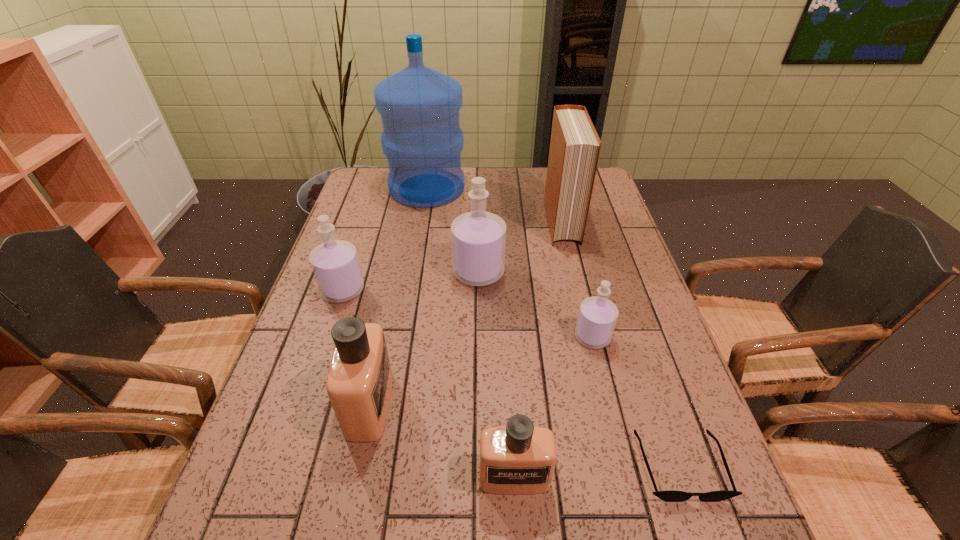
Where is `free spot between the tallest object and the hardback book`? free spot between the tallest object and the hardback book is located at coordinates (494, 205).

You are a GUI agent. You are given a task and a screenshot of the screen. Output one action in this format:
    pyautogui.click(x=<x>, y=<y>)
    Task: Click on the vacant region between the hardback book and the right beige perfume
    The height and width of the screenshot is (540, 960).
    Given the screenshot: What is the action you would take?
    pyautogui.click(x=538, y=349)

This screenshot has height=540, width=960. What are the coordinates of `the closest object to the leftmost purple perfume` in the screenshot? It's located at (359, 384).

This screenshot has height=540, width=960. Find the location of `object that ranks as the sixth closest to the nearest perfume`. object that ranks as the sixth closest to the nearest perfume is located at coordinates (574, 151).

Identify which perfume is the fourth closest to the right beige perfume. Please provide its 2D coordinates. Your answer should be formatted as a tuple, i.e. [(x, y)], where the tuple contains the x and y coordinates of a point satisfying the conditions above.

[(335, 264)]

The height and width of the screenshot is (540, 960). I want to click on perfume that is the nearest to the leftmost purple perfume, so click(359, 384).

I want to click on purple perfume object that ranks as the second closest to the leftmost perfume, so click(x=597, y=317).

Where is `purple perfume that is the closest to the third farthest perfume`? purple perfume that is the closest to the third farthest perfume is located at coordinates (478, 237).

Locate an element on the screen. This screenshot has height=540, width=960. free point that satisfies the following two spatial constraints: 1. on the front side of the tallest object; 2. on the left side of the smallest purple perfume is located at coordinates (401, 337).

You are a GUI agent. You are given a task and a screenshot of the screen. Output one action in this format:
    pyautogui.click(x=<x>, y=<y>)
    Task: Click on the vacant area in the image that satisfies the following two spatial constraints: 1. on the front side of the water jug; 2. on the front label of the bigger beige perfume
    
    Given the screenshot: What is the action you would take?
    pyautogui.click(x=390, y=404)